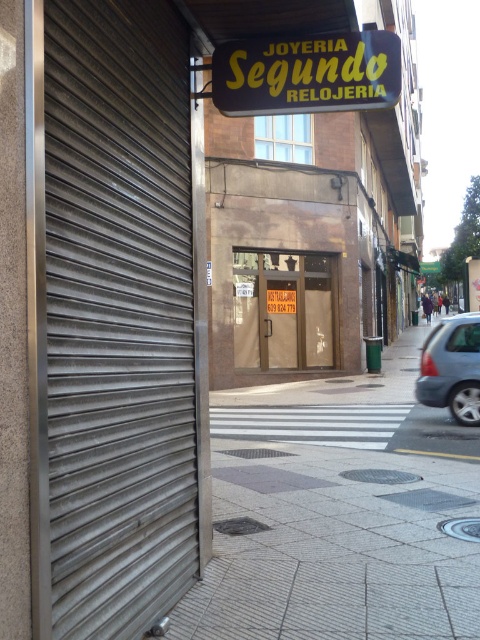
You are a delivery person trying to park your bike. The metallic gray garage door at left and the gray concrete pavement at center are both visible. Which surface can you park on?

The gray concrete pavement at center can be used to park the bike because it is larger than the metallic gray garage door at left, which is smaller and likely not intended for parking.